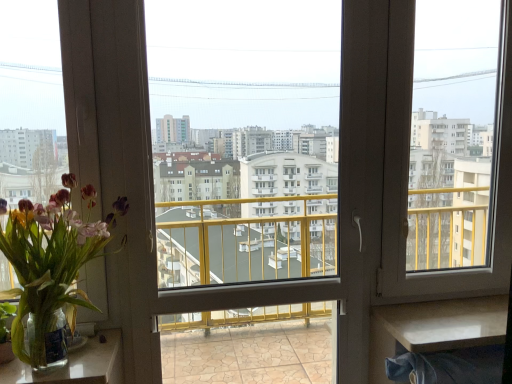
Question: In terms of width, does clear glass vase at lower left, arranged as the first table when viewed from the left, look wider or thinner when compared to translucent glass vase at left?

Choices:
 (A) wide
 (B) thin

Answer: (B)

Question: Is point (105, 377) positioned closer to the camera than point (47, 311)?

Choices:
 (A) farther
 (B) closer

Answer: (A)

Question: Which is farther from the clear glass vase at lower left, which is the second table from right to left?

Choices:
 (A) white glossy table at lower right, the second table viewed from the left
 (B) transparent plastic window screen at center, which is the first window screen in left-to-right order
 (C) translucent glass vase at left
 (D) transparent glass window screen at right, the second window screen viewed from the left

Answer: (B)

Question: Considering the real-world distances, which object is closest to the translucent glass vase at left?

Choices:
 (A) clear glass vase at lower left, which is the second table from right to left
 (B) transparent plastic window screen at center, marked as the second window screen in a right-to-left arrangement
 (C) transparent glass window screen at right, the second window screen viewed from the left
 (D) white glossy table at lower right, the second table viewed from the left

Answer: (A)